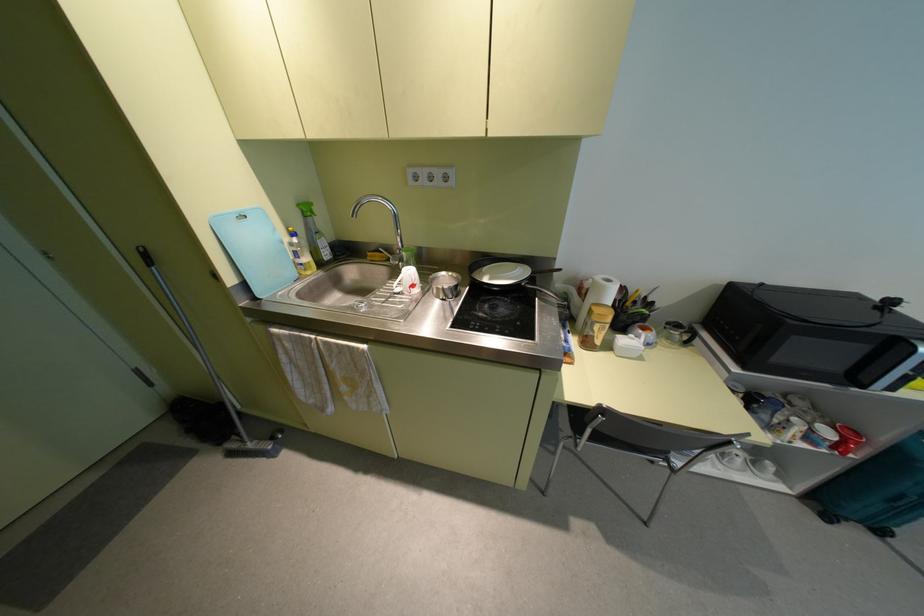
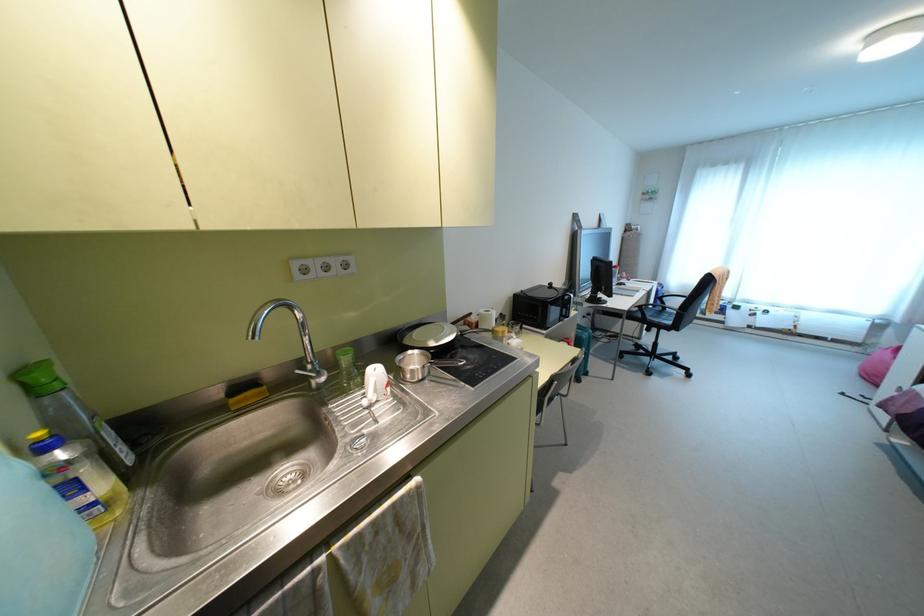
Question: How did the camera likely rotate?

Choices:
 (A) Left
 (B) Right
 (C) Up
 (D) Down

Answer: (B)